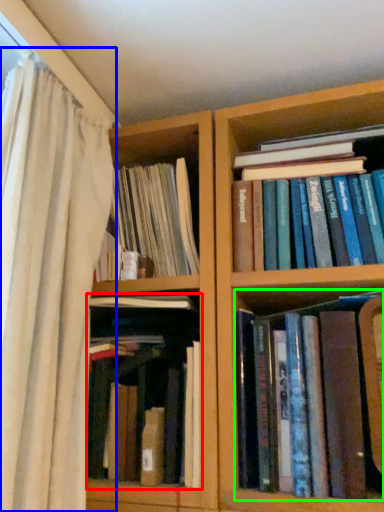
Question: Which object is positioned farthest from book (highlighted by a red box)? Select from curtain (highlighted by a blue box) and book (highlighted by a green box).

Choices:
 (A) curtain
 (B) book

Answer: (B)